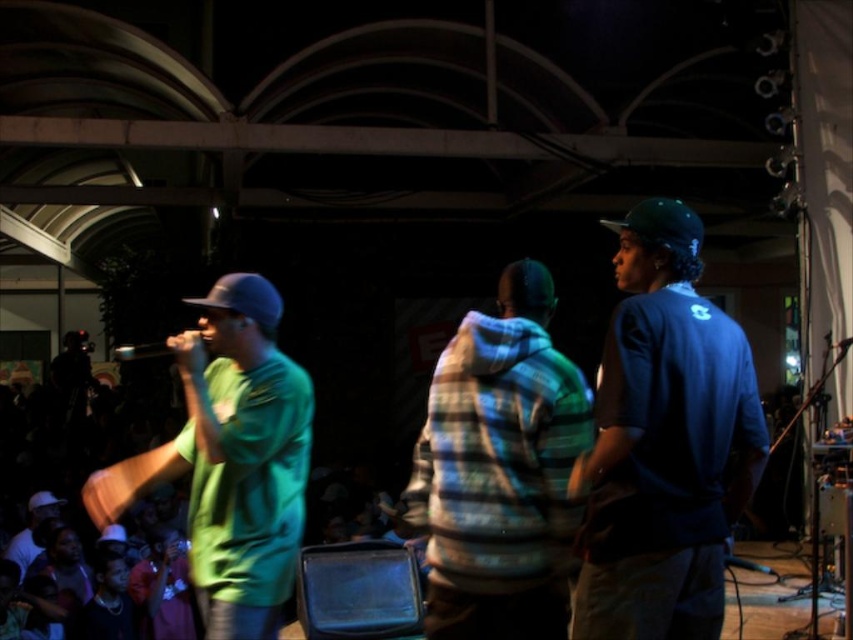
Who is higher up, blue matte shirt at center or plaid fleece jacket at center?

blue matte shirt at center is higher up.

Who is more distant from viewer, (x=657, y=369) or (x=506, y=484)?

The point (x=506, y=484) is more distant.

This screenshot has height=640, width=853. Find the location of `blue matte shirt at center`. blue matte shirt at center is located at coordinates (663, 442).

The height and width of the screenshot is (640, 853). Describe the element at coordinates (498, 470) in the screenshot. I see `plaid fleece jacket at center` at that location.

Is point (469, 392) closer to viewer compared to point (198, 579)?

Yes, it is.

The width and height of the screenshot is (853, 640). I want to click on plaid fleece jacket at center, so click(498, 470).

Between point (578, 611) and point (244, 524), which one is positioned in front?

Point (578, 611) is in front.

What do you see at coordinates (663, 442) in the screenshot? I see `blue matte shirt at center` at bounding box center [663, 442].

This screenshot has height=640, width=853. I want to click on blue matte shirt at center, so click(663, 442).